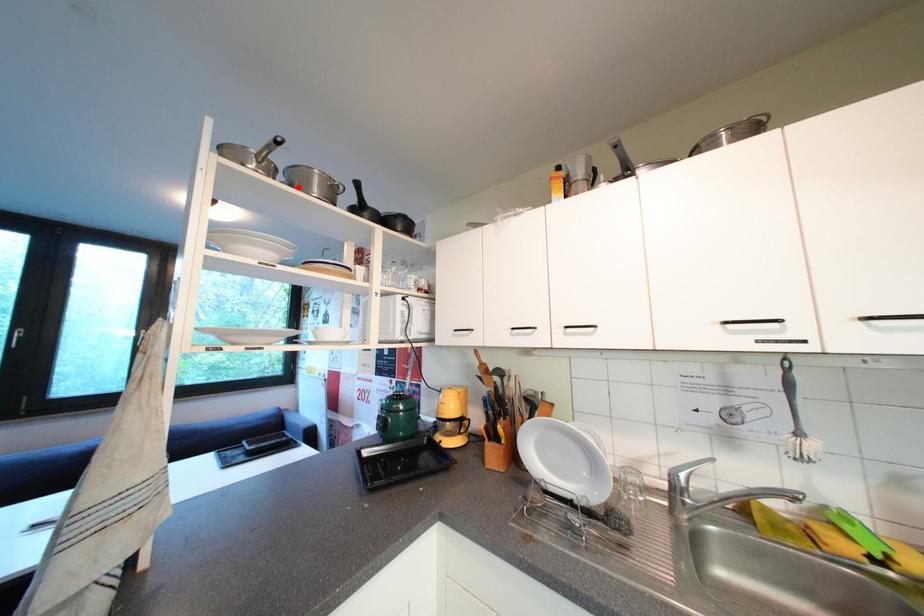
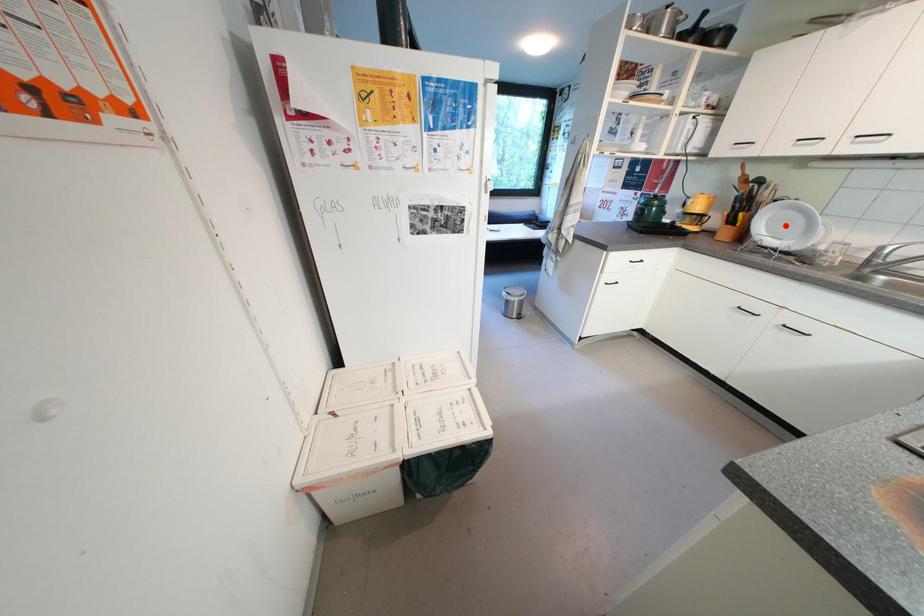
In the scene shown: I am providing you with two images of the same scene from different viewpoints. A red point is marked on the first image and another point is marked on the second image. Is the marked point in image1 the same physical position as the marked point in image2?

No